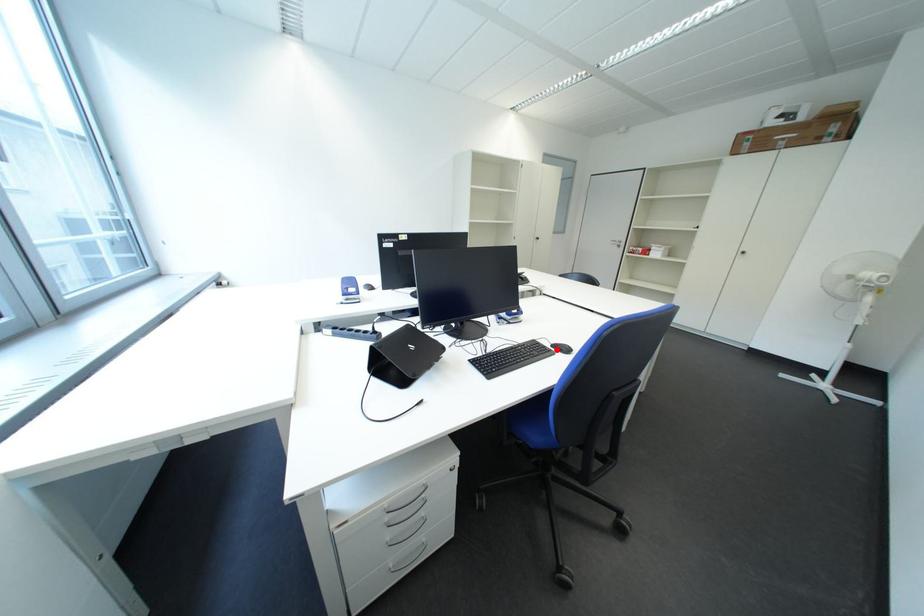
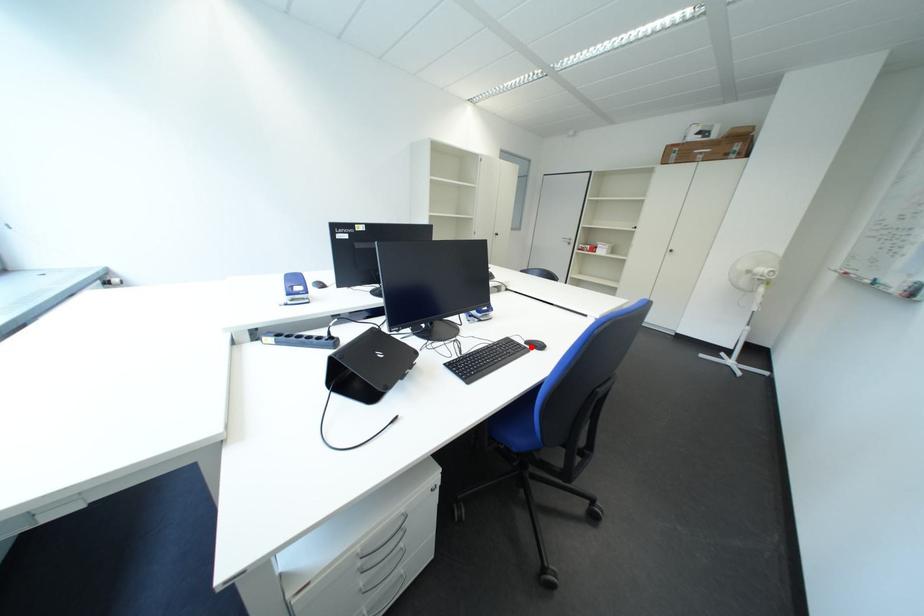
I am providing you with two images of the same scene from different viewpoints. A red point is marked on the first image and another point is marked on the second image. Does the point marked in image1 correspond to the same location as the one in image2?

Yes